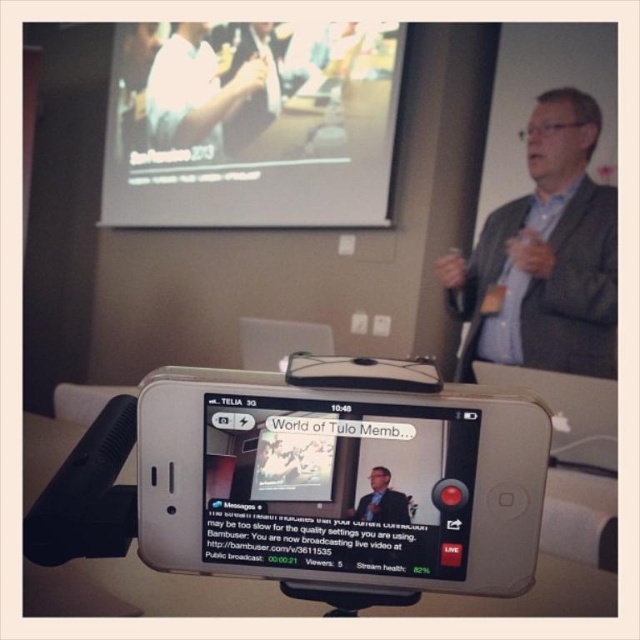
You are a stagehand standing 1.2 meters away from the podium. You need to adjust the lighting so it points towards the gray textured blazer at upper right. Can you reach the blazer with the light?

The gray textured blazer at upper right is 1.18 meters away from the viewer, so yes, the stagehand can reach it with the light since the distance is slightly less than the 1.2 meters they are standing away from the podium.

Consider the image. You are attending a virtual conference and need to focus on the presenter. The gray textured blazer at upper right and the white matte shirt at upper left are both visible on the screen. Which one is closer to the camera based on their positions?

The gray textured blazer at upper right is in front of the white matte shirt at upper left, so it is closer to the camera.

You are organizing a live stream event and need to place a 10 cm wide decorative ribbon between the matte black smartphone at center and the gray textured blazer at upper right. Can the ribbon fit horizontally between them without overlapping either object?

The matte black smartphone at center is thinner than the gray textured blazer at upper right. However, the exact distance between them isn